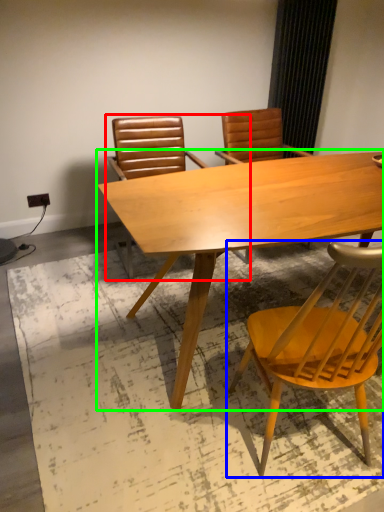
Question: Which is farther away from chair (highlighted by a red box)? chair (highlighted by a blue box) or table (highlighted by a green box)?

Choices:
 (A) chair
 (B) table

Answer: (A)